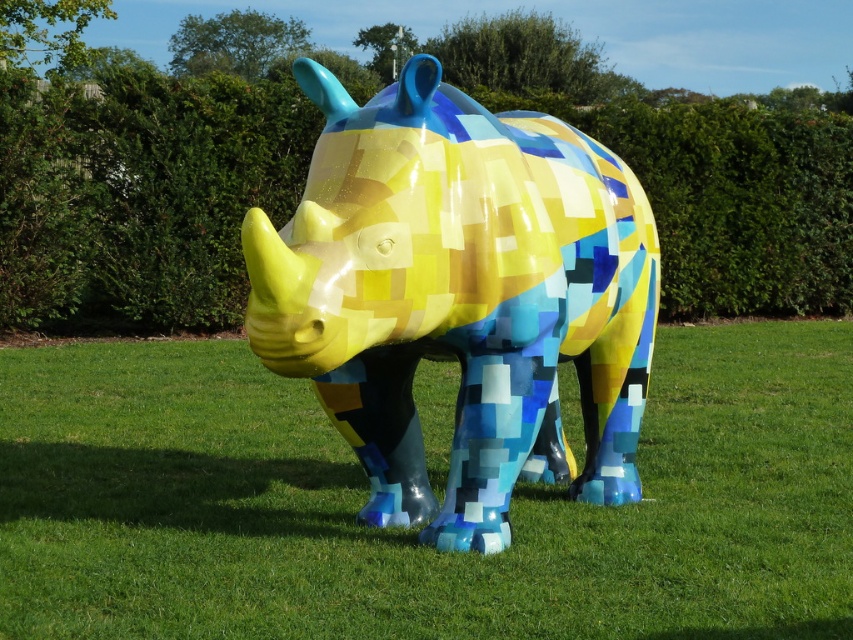
You are standing in front of the sculpture and want to take a photo that includes both the pixelated yellow rhino at center and the green leafy hedge at center. Which object will appear larger in the photo?

The pixelated yellow rhino at center will appear larger in the photo because it is closer to the viewer than the green leafy hedge at center.

You are standing on the grassy area and want to take a photo of the pixelated plastic rhino at center. If you move 0.1 units to the right along the x and y axes, will you still be facing the rhino?

The pixelated plastic rhino at center is located at point (460, 296). Moving 0.1 units to the right along both the x and y axes would place you at a new position. Since the rhino is at the center, moving slightly to the right might still keep it in your view, but precise positioning depends on your original angle and distance. However, based on the coordinates, the rhino remains at its position, so you should still be facing it unless obstructed.

You are an art student observing the pixelated yellow rhino at center and the pixelated plastic rhino at center in the image. Which one is located to the right?

The pixelated plastic rhino at center is located to the right of the pixelated yellow rhino at center.